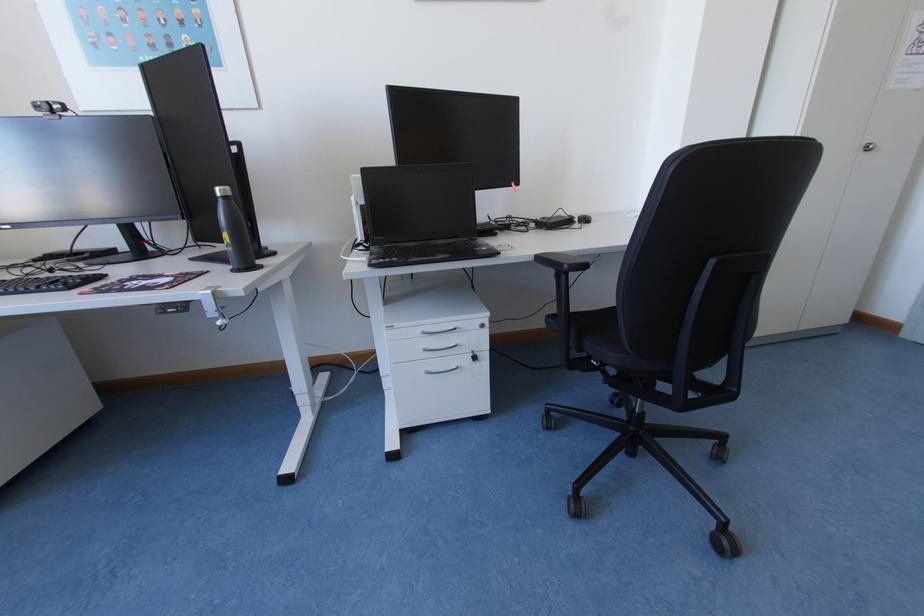
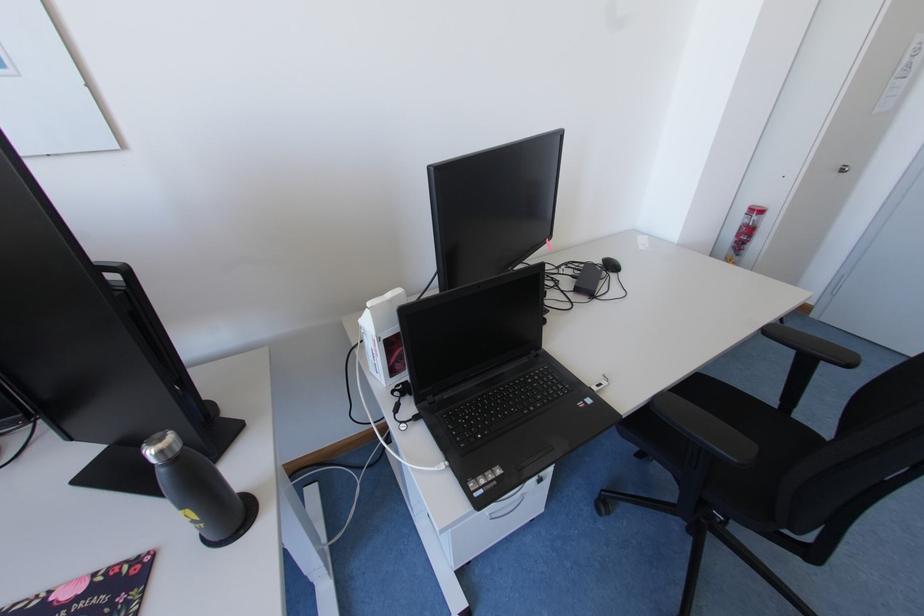
Which direction would the cameraman need to move to produce the second image?

The cameraman walked toward left, forward.